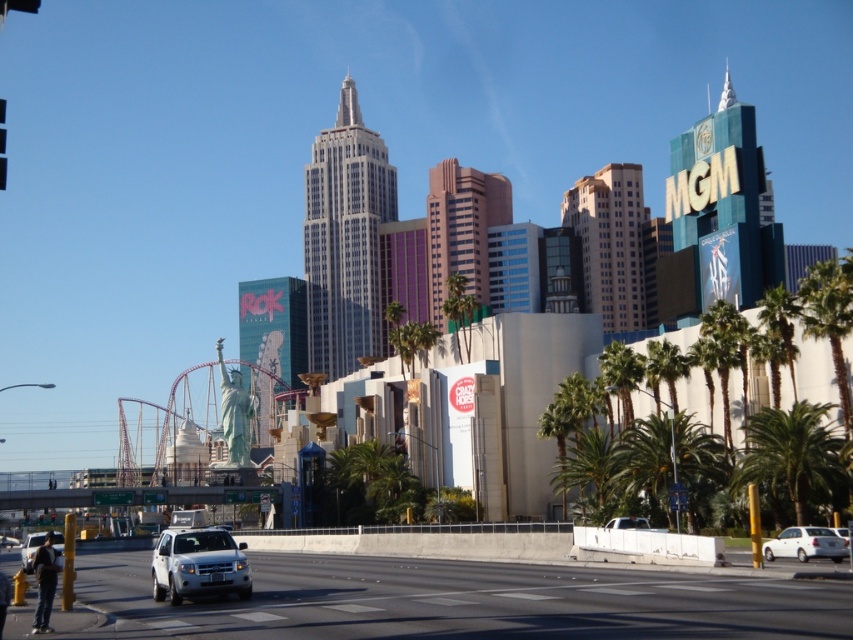
Which is more to the left, white matte suv at lower left or green leafy palm tree at center-right?

white matte suv at lower left is more to the left.

Where is `white matte suv at lower left`? The width and height of the screenshot is (853, 640). white matte suv at lower left is located at coordinates (198, 564).

The image size is (853, 640). I want to click on white matte suv at lower left, so click(x=198, y=564).

Which is more to the right, white matte suv at lower left or silver metallic suv at lower left?

From the viewer's perspective, white matte suv at lower left appears more on the right side.

Identify the location of white matte suv at lower left. (198, 564).

Does point (192, 573) come closer to viewer compared to point (38, 541)?

Yes.

Locate an element on the screen. This screenshot has width=853, height=640. white matte suv at lower left is located at coordinates (198, 564).

Based on the photo, is green leafy palm tree at center-right positioned behind white matte sedan at lower right?

Yes, it is behind white matte sedan at lower right.

Which of these two, green leafy palm tree at center-right or white matte sedan at lower right, stands shorter?

white matte sedan at lower right

Between point (601, 433) and point (807, 528), which one is positioned in front?

Positioned in front is point (807, 528).

The width and height of the screenshot is (853, 640). What are the coordinates of `green leafy palm tree at center-right` in the screenshot? It's located at pos(590,476).